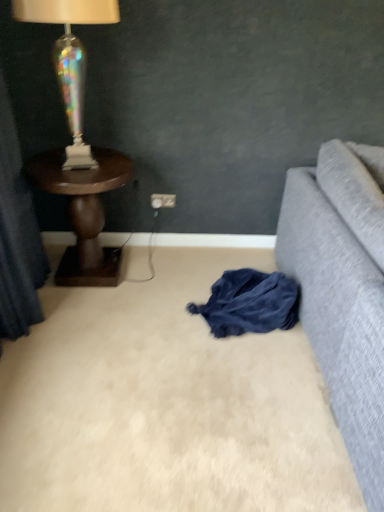
Question: From the image's perspective, is dark blue fabric at lower center above or below dark blue fabric at left?

Choices:
 (A) below
 (B) above

Answer: (A)

Question: Looking at the image, does dark blue fabric at lower center seem bigger or smaller compared to dark blue fabric at left?

Choices:
 (A) small
 (B) big

Answer: (A)

Question: Based on their relative distances, which object is farther from the dark wood side table at left?

Choices:
 (A) dark blue fabric at lower center
 (B) white plastic power outlet at center
 (C) iridescent glass lamp at upper left
 (D) dark blue fabric at left

Answer: (A)

Question: Which object is the farthest from the iridescent glass lamp at upper left?

Choices:
 (A) white plastic power outlet at center
 (B) dark wood side table at left
 (C) dark blue fabric at lower center
 (D) dark blue fabric at left

Answer: (C)